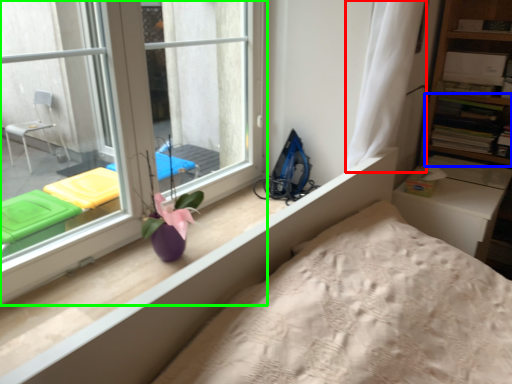
Question: Which object is the farthest from curtain (highlighted by a red box)? Choose among these: shelf (highlighted by a blue box) or window (highlighted by a green box).

Choices:
 (A) shelf
 (B) window

Answer: (A)